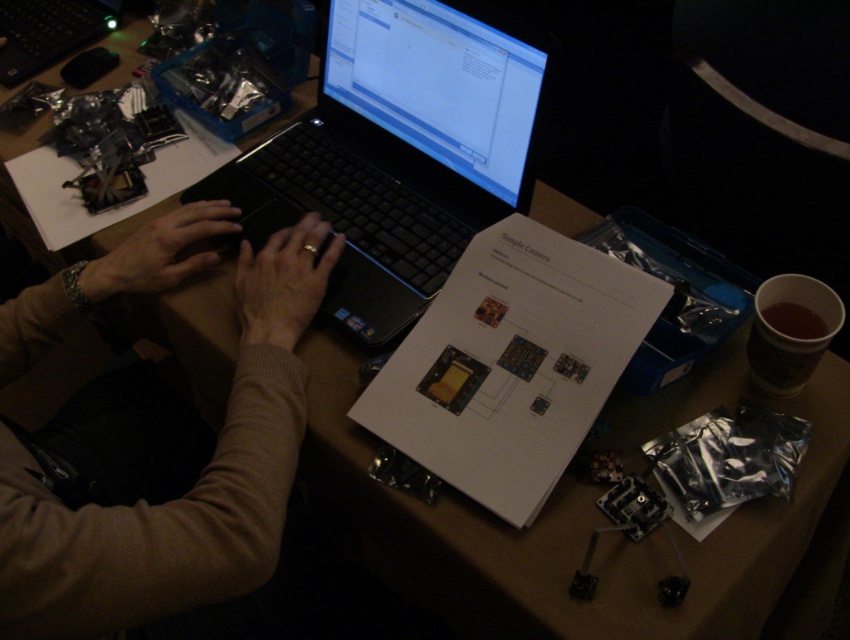
Can you confirm if matte black hands at center is shorter than black plastic laptop at upper center?

Indeed, matte black hands at center has a lesser height compared to black plastic laptop at upper center.

Is the position of matte black hands at center more distant than that of black plastic laptop at upper center?

That is False.

Image resolution: width=850 pixels, height=640 pixels. Identify the location of matte black hands at center. (284, 282).

At what (x,y) coordinates should I click in order to perform the action: click on matte black hands at center. Please return your answer as a coordinate pair (x, y). The width and height of the screenshot is (850, 640). Looking at the image, I should click on (284, 282).

Measure the distance from black matte laptop at center to matte black hand at center.

black matte laptop at center and matte black hand at center are 7.86 inches apart.

Does point (378, 177) lie in front of point (185, 234)?

No, (378, 177) is further to viewer.

In order to click on black matte laptop at center in this screenshot , I will do `click(395, 152)`.

Between black matte laptop at center and black plastic laptop at upper center, which one has more height?

black matte laptop at center is taller.

Is black matte laptop at center wider than black plastic laptop at upper center?

Yes.

You are a GUI agent. You are given a task and a screenshot of the screen. Output one action in this format:
    pyautogui.click(x=<x>, y=<y>)
    Task: Click on the black matte laptop at center
    
    Given the screenshot: What is the action you would take?
    pyautogui.click(x=395, y=152)